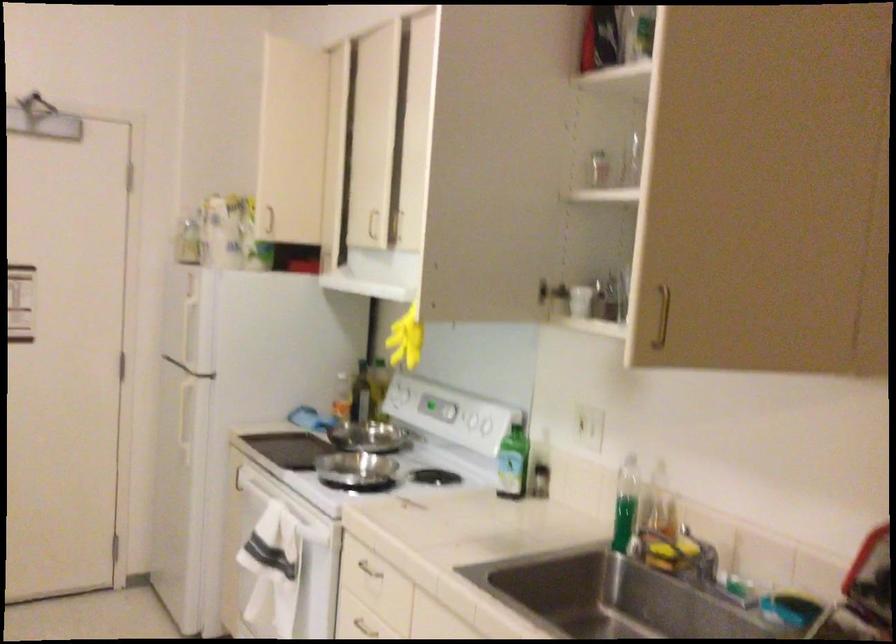
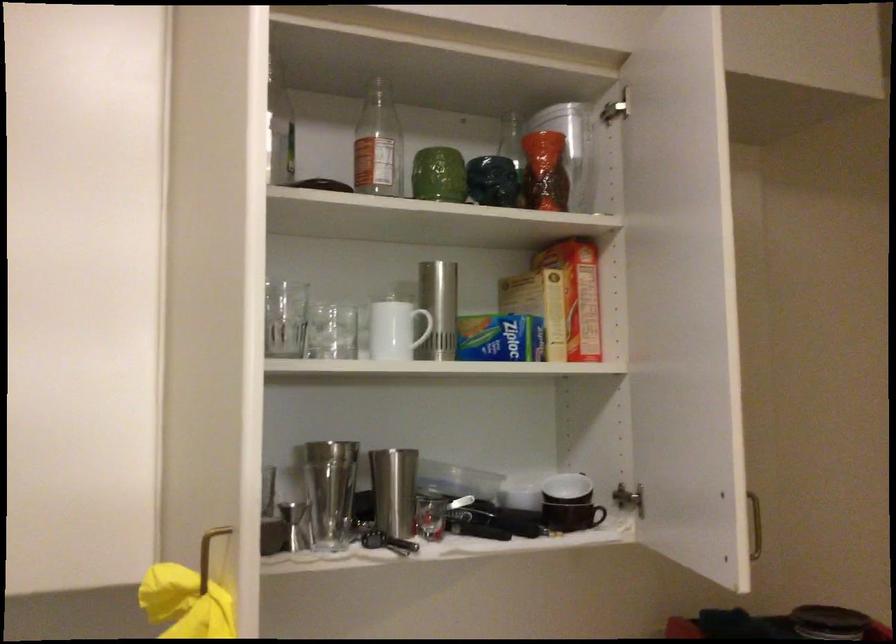
The point at (x=823, y=357) is marked in the first image. Where is the corresponding point in the second image?

(591, 516)